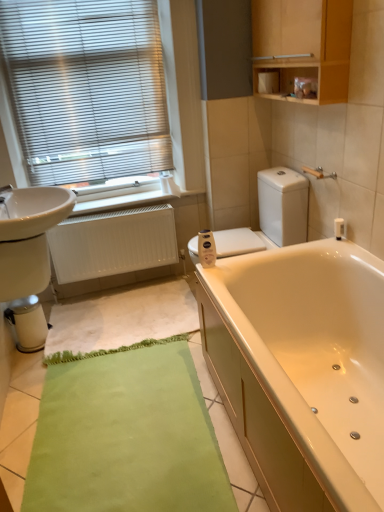
Describe the element at coordinates (303, 46) in the screenshot. I see `wooden cabinet at upper right` at that location.

This screenshot has height=512, width=384. What are the coordinates of `white glossy toilet at center` in the screenshot? It's located at (283, 206).

This screenshot has width=384, height=512. What do you see at coordinates (283, 206) in the screenshot? I see `white glossy toilet at center` at bounding box center [283, 206].

Identify the location of white glossy sink at left. The height and width of the screenshot is (512, 384). (29, 237).

The image size is (384, 512). What do you see at coordinates (86, 88) in the screenshot?
I see `metallic blinds at upper left` at bounding box center [86, 88].

Where is `wooden cabinet at upper right`? wooden cabinet at upper right is located at coordinates (303, 46).

Is metallic blinds at upper left turned away from white matte toilet paper at center, which is the first toilet paper in bottom-to-top order?

That's not correct — metallic blinds at upper left is not looking away from white matte toilet paper at center, which is the first toilet paper in bottom-to-top order.

How far apart are metallic blinds at upper left and white matte toilet paper at center, acting as the 2th toilet paper starting from the back?

1.14 meters.

Between metallic blinds at upper left and white matte toilet paper at center, which is counted as the 2th toilet paper, starting from the right, which one is positioned in front?

white matte toilet paper at center, which is counted as the 2th toilet paper, starting from the right.

Measure the distance from wooden cabinet at upper right to white matte toilet paper at center, positioned as the second toilet paper in top-to-bottom order.

A distance of 3.35 feet exists between wooden cabinet at upper right and white matte toilet paper at center, positioned as the second toilet paper in top-to-bottom order.

Which of these two, wooden cabinet at upper right or white matte toilet paper at center, acting as the 2th toilet paper starting from the back, stands taller?

wooden cabinet at upper right.

Would you say wooden cabinet at upper right is outside white matte toilet paper at center, the 1th toilet paper positioned from the front?

wooden cabinet at upper right lies outside white matte toilet paper at center, the 1th toilet paper positioned from the front,'s area.

Which of these two, wooden cabinet at upper right or white matte toilet paper at center, the 1th toilet paper positioned from the front, is thinner?

Thinner between the two is white matte toilet paper at center, the 1th toilet paper positioned from the front.

How many degrees apart are the facing directions of white glossy toilet at center and metallic silver water heater at lower left?

177 degrees separate the facing orientations of white glossy toilet at center and metallic silver water heater at lower left.

From the image's perspective, between white glossy toilet at center and metallic silver water heater at lower left, which one is located above?

white glossy toilet at center appears higher in the image.

Does point (191, 241) come closer to viewer compared to point (44, 327)?

Yes, point (191, 241) is closer to viewer.

Is white glossy toilet at center taller than metallic silver water heater at lower left?

Yes.

Which object is closer to the camera taking this photo, white matte radiator at lower left or wooden cabinet at upper right?

wooden cabinet at upper right.

In the scene shown: From a real-world perspective, which object stands above the other?

From a 3D spatial view, wooden cabinet at upper right is above.

From the image's perspective, is white matte radiator at lower left above or below wooden cabinet at upper right?

Clearly, from the image's perspective, white matte radiator at lower left is below wooden cabinet at upper right.

Can you confirm if white glossy toilet at center is wider than white textured bath mat at lower center?

Yes.

Measure the distance between white glossy toilet at center and white textured bath mat at lower center.

white glossy toilet at center and white textured bath mat at lower center are 73.53 centimeters apart from each other.

Identify the location of bath mat directly beneath the white glossy toilet at center (from a real-world perspective). (121, 320).

Is white textured bath mat at lower center at the back of white glossy toilet at center?

That's not correct — white glossy toilet at center is not looking away from white textured bath mat at lower center.

From a real-world perspective, is wooden cabinet at upper right on metallic blinds at upper left?

Correct, in the physical world, wooden cabinet at upper right is higher than metallic blinds at upper left.

Is point (347, 94) more distant than point (81, 145)?

No, (347, 94) is closer to viewer.

Would you say wooden cabinet at upper right is to the left or to the right of metallic blinds at upper left in the picture?

Clearly, wooden cabinet at upper right is on the right of metallic blinds at upper left in the image.

From their relative heights in the image, would you say wooden cabinet at upper right is taller or shorter than metallic blinds at upper left?

wooden cabinet at upper right is shorter than metallic blinds at upper left.

Is white glossy toilet at center placed right next to wooden cabinet at upper right?

white glossy toilet at center is not next to wooden cabinet at upper right, and they're not touching.

Does white glossy toilet at center lie behind wooden cabinet at upper right?

Yes, white glossy toilet at center is further from the viewer.

Is white glossy toilet at center smaller than wooden cabinet at upper right?

No, white glossy toilet at center is not smaller than wooden cabinet at upper right.

Could wooden cabinet at upper right be considered to be inside white glossy toilet at center?

No, wooden cabinet at upper right is located outside of white glossy toilet at center.

At what (x,y) coordinates should I click in order to perform the action: click on window blind above the white matte toilet paper at center, which is counted as the 2th toilet paper, starting from the right (from a real-world perspective). Please return your answer as a coordinate pair (x, y). Looking at the image, I should click on (86, 88).

Where is `medicine cabinet lying in front of the white matte toilet paper at center, positioned as the second toilet paper in top-to-bottom order`? This screenshot has width=384, height=512. medicine cabinet lying in front of the white matte toilet paper at center, positioned as the second toilet paper in top-to-bottom order is located at coordinates (303, 46).

Which object lies further to the anchor point white matte toilet paper at upper center, placed as the 2th toilet paper when sorted from left to right, white matte toilet paper at center, the first toilet paper viewed from the left, or white glossy toilet at center?

white matte toilet paper at center, the first toilet paper viewed from the left, is further to white matte toilet paper at upper center, placed as the 2th toilet paper when sorted from left to right.

Estimate the real-world distances between objects in this image. Which object is closer to metallic blinds at upper left, wooden cabinet at upper right or metallic silver water heater at lower left?

wooden cabinet at upper right.

Estimate the real-world distances between objects in this image. Which object is further from metallic silver water heater at lower left, metallic blinds at upper left or white matte toilet paper at center, the first toilet paper viewed from the left?

Among the two, metallic blinds at upper left is located further to metallic silver water heater at lower left.

When comparing their distances from white textured bath mat at lower center, does metallic blinds at upper left or metallic silver water heater at lower left seem closer?

metallic silver water heater at lower left is positioned closer to the anchor white textured bath mat at lower center.

Which object lies further to the anchor point white glossy sink at left, white matte toilet paper at center, the first toilet paper viewed from the left, or white textured bath mat at lower center?

white matte toilet paper at center, the first toilet paper viewed from the left, is positioned further to the anchor white glossy sink at left.

Considering their positions, is wooden cabinet at upper right positioned closer to white glossy sink at left than white textured bath mat at lower center?

white textured bath mat at lower center is closer to white glossy sink at left.

Which object lies nearer to the anchor point white glossy sink at left, wooden cabinet at upper right or white glossy toilet at center?

white glossy toilet at center is closer to white glossy sink at left.

From the image, which object appears to be nearer to white textured bath mat at lower center, white matte toilet paper at upper center, which is the 1th toilet paper from top to bottom, or white matte radiator at lower left?

white matte radiator at lower left.

The height and width of the screenshot is (512, 384). I want to click on radiator between metallic blinds at upper left and white textured bath mat at lower center in the vertical direction, so click(x=113, y=243).

You are a GUI agent. You are given a task and a screenshot of the screen. Output one action in this format:
    pyautogui.click(x=<x>, y=<y>)
    Task: Click on the sink between metallic blinds at upper left and metallic silver water heater at lower left in the up-down direction
    
    Given the screenshot: What is the action you would take?
    pyautogui.click(x=29, y=237)

Find the location of a particular element. This screenshot has width=384, height=512. radiator situated between white glossy sink at left and white matte toilet paper at upper center, the second toilet paper in the front-to-back sequence, from left to right is located at coordinates [113, 243].

At what (x,y) coordinates should I click in order to perform the action: click on toilet paper between metallic silver water heater at lower left and white matte toilet paper at upper center, acting as the first toilet paper starting from the right, in the horizontal direction. Please return your answer as a coordinate pair (x, y). This screenshot has width=384, height=512. Looking at the image, I should click on (206, 248).